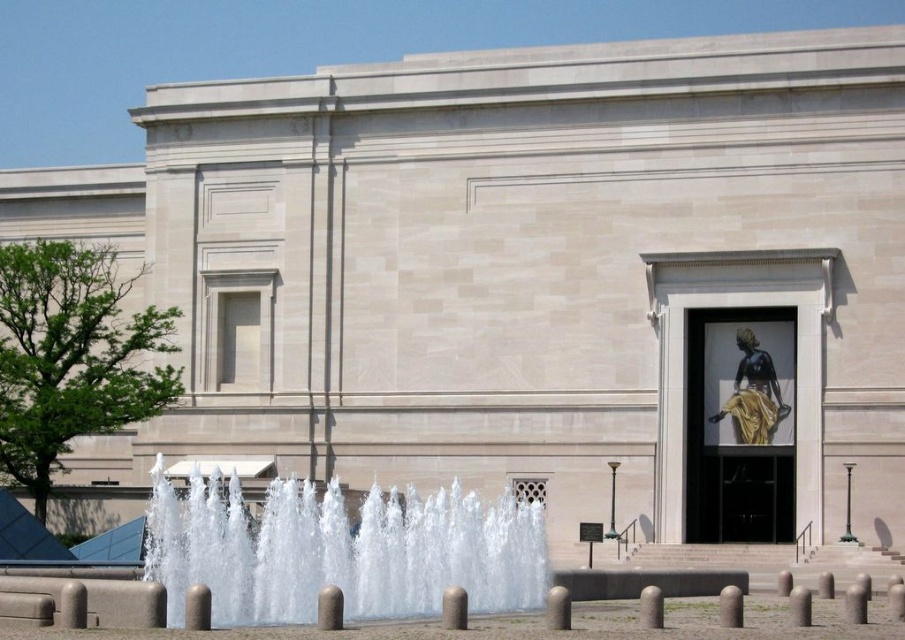
You are standing in front of the classical building and want to locate the exact point at coordinates (x=749, y=381). Where would this point be located?

The point at coordinates (x=749, y=381) is on the black polished statue at center.

You are a photographer planning to capture the entire scene of the classical building with both the clear water at center and the black polished statue at center in the frame. Given that your camera has a fixed focal length, which object should you position closer to your camera to ensure both are visible without cropping?

Since the clear water at center is larger in size than the black polished statue at center, to include both in the frame without cropping, you should position the black polished statue at center closer to the camera. This adjustment will help balance their sizes in the photograph, ensuring both fit within the frame.